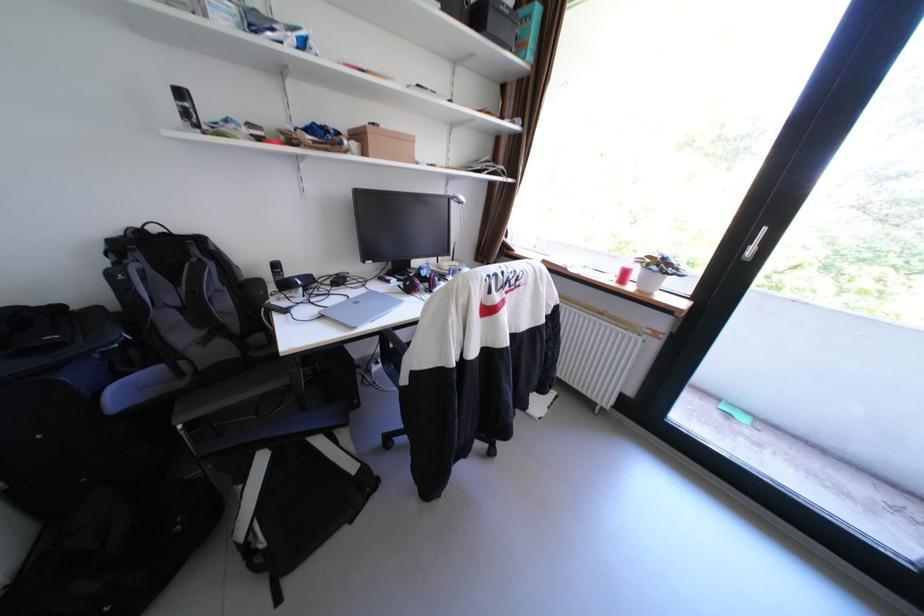
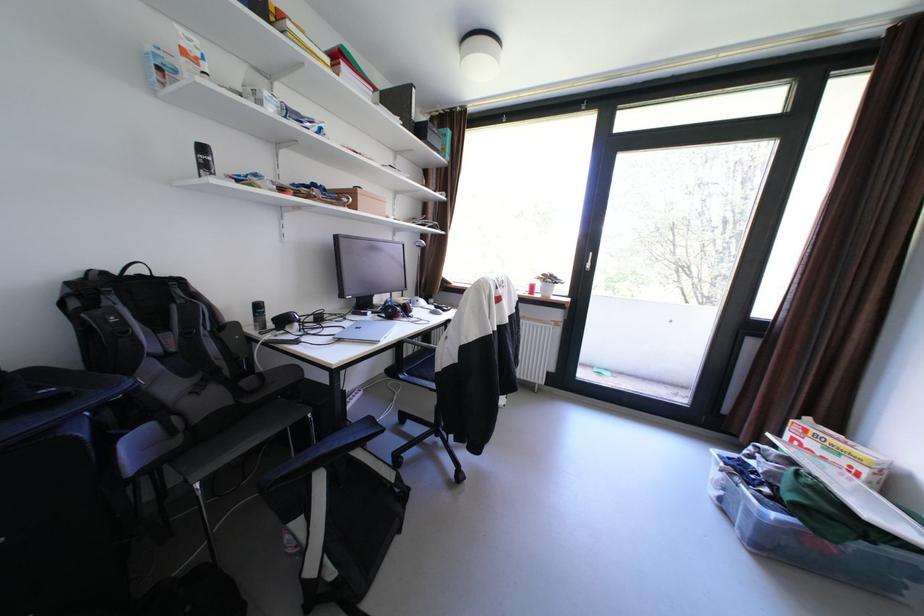
Find the pixel in the second image that matches [311,429] in the first image.

(361, 440)